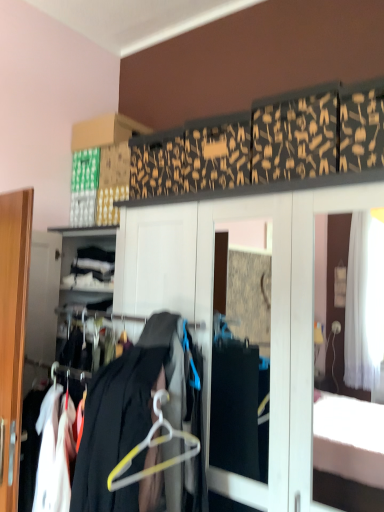
Question: From their relative heights in the image, would you say black fabric coat at center is taller or shorter than white plastic hanger at center?

Choices:
 (A) tall
 (B) short

Answer: (A)

Question: Relative to white plastic hanger at center, is black fabric coat at center in front or behind?

Choices:
 (A) behind
 (B) front

Answer: (B)

Question: Choose the correct answer: Is black fabric coat at center inside white plastic hanger at center or outside it?

Choices:
 (A) inside
 (B) outside

Answer: (B)

Question: Visually, is white plastic hanger at center positioned to the left or to the right of black fabric coat at center?

Choices:
 (A) right
 (B) left

Answer: (A)

Question: From the image's perspective, is white plastic hanger at center above or below black fabric coat at center?

Choices:
 (A) above
 (B) below

Answer: (A)

Question: Considering the positions of white plastic hanger at center and black fabric coat at center in the image, is white plastic hanger at center taller or shorter than black fabric coat at center?

Choices:
 (A) tall
 (B) short

Answer: (B)

Question: Considering the positions of white plastic hanger at center and black fabric coat at center in the image, is white plastic hanger at center wider or thinner than black fabric coat at center?

Choices:
 (A) thin
 (B) wide

Answer: (A)